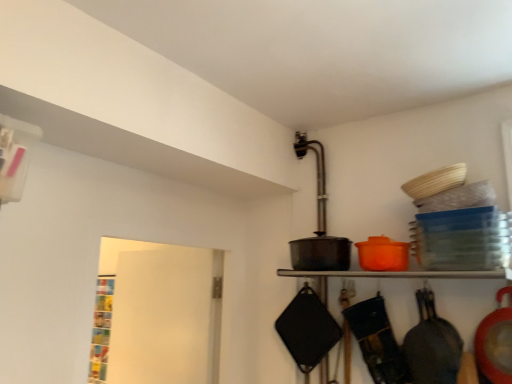
Question: Does point (465, 274) appear closer or farther from the camera than point (421, 372)?

Choices:
 (A) closer
 (B) farther

Answer: (B)

Question: Visually, is matte black pot at center positioned to the left or to the right of matte black frying pan at right, which is the first frying pan from right to left?

Choices:
 (A) left
 (B) right

Answer: (A)

Question: Estimate the real-world distances between objects in this image. Which object is closer to the white matte door at left?

Choices:
 (A) matte black pot at center
 (B) matte black frying pan at right, acting as the second frying pan starting from the left
 (C) black matte frying pan at lower right, placed as the 1th frying pan when sorted from left to right

Answer: (A)

Question: Which object is positioned closest to the matte black frying pan at right, which is the first frying pan from right to left?

Choices:
 (A) black matte frying pan at lower right, placed as the 1th frying pan when sorted from left to right
 (B) white matte door at left
 (C) matte black pot at center

Answer: (A)